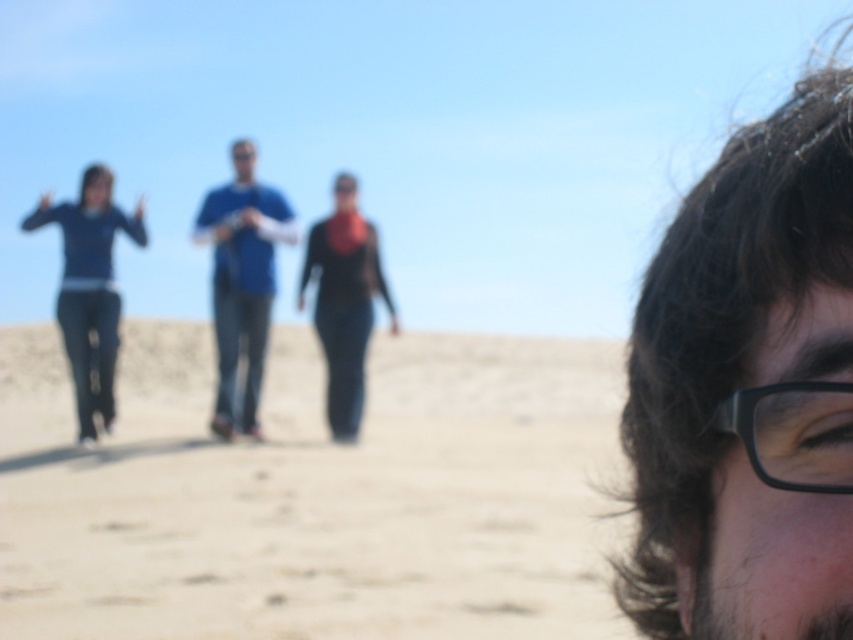
Is blue denim jeans at left positioned before black matte jacket at center?

Yes, it is in front of black matte jacket at center.

This screenshot has width=853, height=640. Describe the element at coordinates (90, 289) in the screenshot. I see `blue denim jeans at left` at that location.

Does point (103, 428) come farther from viewer compared to point (334, 252)?

No, (103, 428) is in front of (334, 252).

The image size is (853, 640). Find the location of `blue denim jeans at left`. blue denim jeans at left is located at coordinates (90, 289).

Who is positioned more to the right, blue fabric shirt at center or blue denim jeans at left?

Positioned to the right is blue fabric shirt at center.

Which is behind, point (230, 333) or point (109, 426)?

The point (109, 426) is more distant.

Image resolution: width=853 pixels, height=640 pixels. Find the location of `blue fabric shirt at center`. blue fabric shirt at center is located at coordinates (242, 280).

You are a GUI agent. You are given a task and a screenshot of the screen. Output one action in this format:
    pyautogui.click(x=<x>, y=<y>)
    Task: Click on the blue fabric shirt at center
    
    Given the screenshot: What is the action you would take?
    pyautogui.click(x=242, y=280)

Does beige sandy ground at center have a greater width compared to black plastic glasses at upper right?

Yes, beige sandy ground at center is wider than black plastic glasses at upper right.

Between beige sandy ground at center and black plastic glasses at upper right, which one has less height?

Standing shorter between the two is black plastic glasses at upper right.

Is point (141, 442) farther from camera compared to point (752, 400)?

Yes, it is.

I want to click on beige sandy ground at center, so click(x=311, y=493).